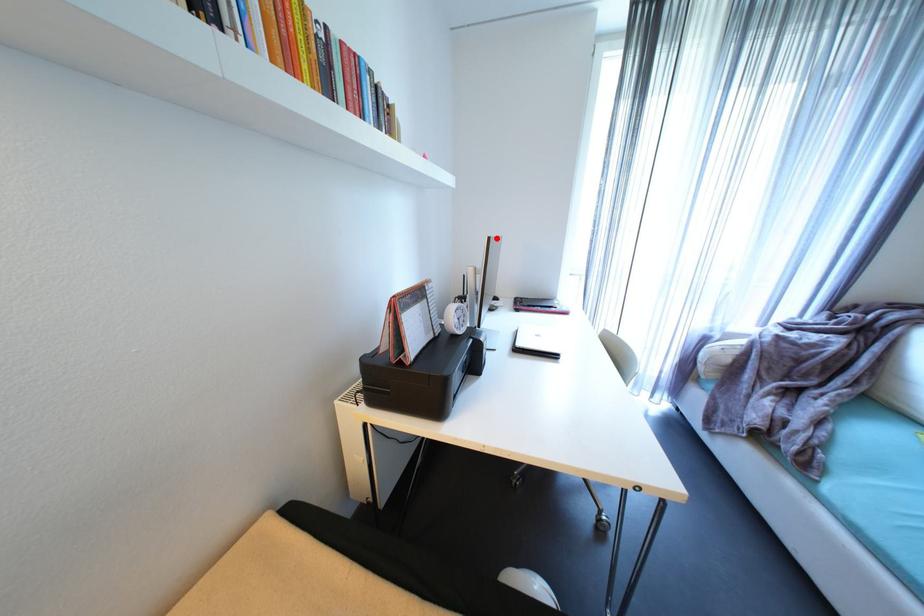
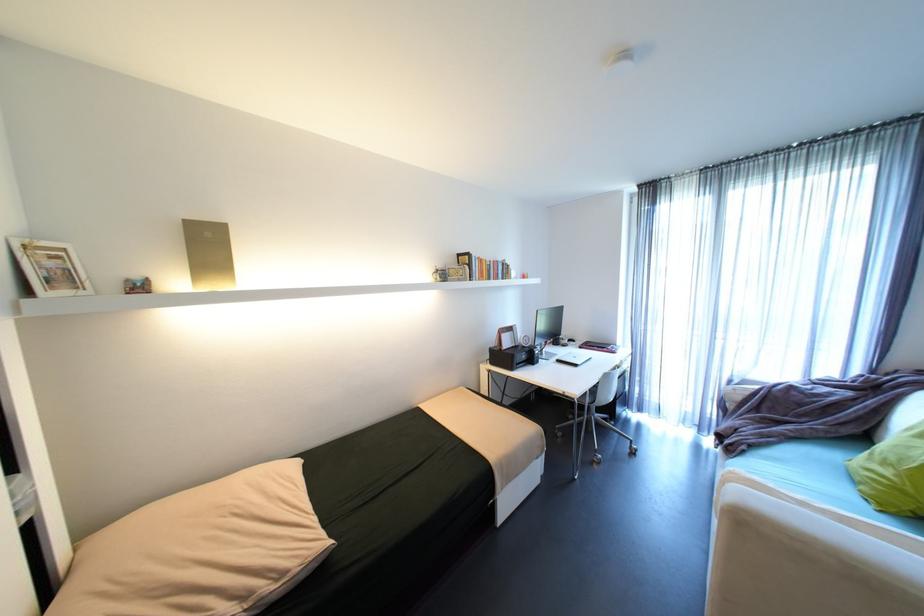
The point at the highlighted location is marked in the first image. Where is the corresponding point in the second image?

(544, 310)